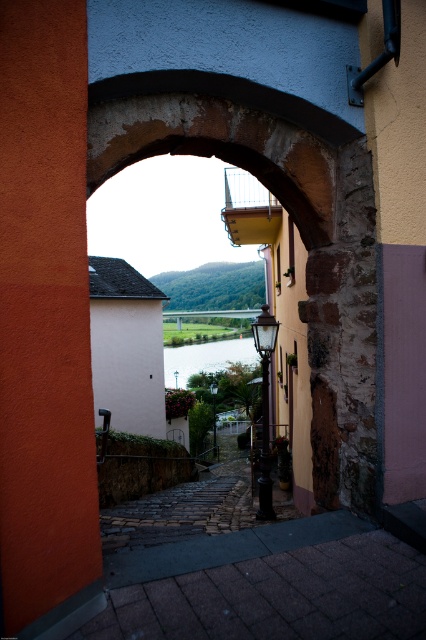
Can you confirm if clear water at center is positioned below matte black lamp post at center?

No.

Can you confirm if clear water at center is bigger than matte black lamp post at center?

Yes.

At what (x,y) coordinates should I click in order to perform the action: click on clear water at center. Please return your answer as a coordinate pair (x, y). Image resolution: width=426 pixels, height=640 pixels. Looking at the image, I should click on (206, 356).

Can you confirm if polished brass lamp post at center is positioned above matte black lamp post at center?

Indeed, polished brass lamp post at center is positioned over matte black lamp post at center.

Is polished brass lamp post at center smaller than matte black lamp post at center?

Incorrect, polished brass lamp post at center is not smaller in size than matte black lamp post at center.

The image size is (426, 640). I want to click on polished brass lamp post at center, so click(264, 406).

Is point (11, 522) in front of point (215, 452)?

Yes, point (11, 522) is in front of point (215, 452).

Does orange stucco wall at left have a greater height compared to matte black lamp post at center?

Correct, orange stucco wall at left is much taller as matte black lamp post at center.

Which is in front, point (60, 177) or point (213, 394)?

Point (60, 177) is more forward.

Image resolution: width=426 pixels, height=640 pixels. What are the coordinates of `orange stucco wall at left` in the screenshot? It's located at (45, 324).